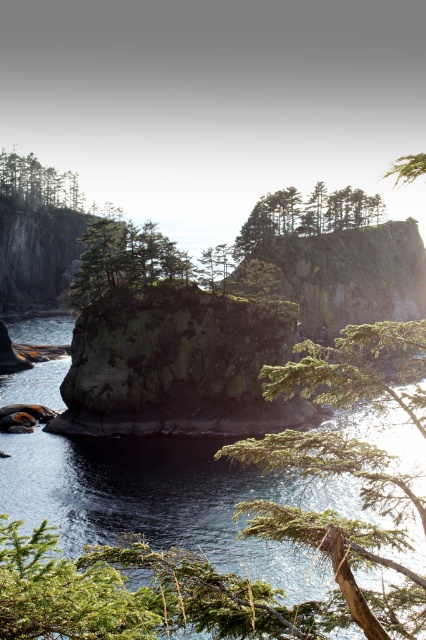
Question: Which point is farther to the camera?

Choices:
 (A) (28, 198)
 (B) (391, 621)
 (C) (118, 262)

Answer: (A)

Question: Does dark blue water at center come in front of green matte tree at center?

Choices:
 (A) yes
 (B) no

Answer: (A)

Question: Is dark blue water at center to the left of green matte tree at center from the viewer's perspective?

Choices:
 (A) no
 (B) yes

Answer: (B)

Question: Can you confirm if green textured tree at center is positioned above green rough tree at center?

Choices:
 (A) no
 (B) yes

Answer: (A)

Question: Which is farther from the green textured tree at center?

Choices:
 (A) green matte tree at upper left
 (B) dark blue water at center
 (C) green rough tree at center
 (D) green matte tree at center

Answer: (A)

Question: Which point is closer to the camera taking this photo?

Choices:
 (A) pos(316,433)
 (B) pos(109,252)

Answer: (A)